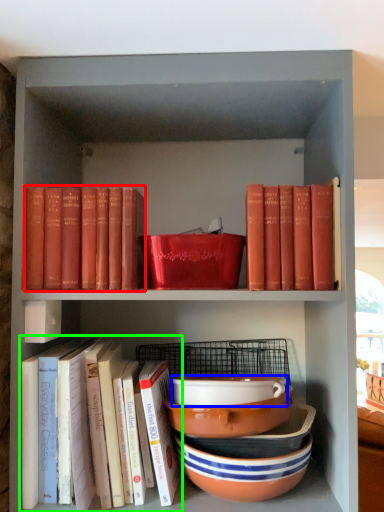
Question: Estimate the real-world distances between objects in this image. Which object is farther from book (highlighted by a red box), bowl (highlighted by a blue box) or book (highlighted by a green box)?

Choices:
 (A) bowl
 (B) book

Answer: (A)